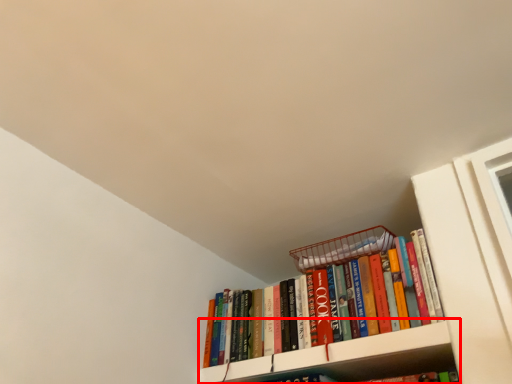
Question: From the image's perspective, what is the correct spatial relationship of cabinet (annotated by the red box) in relation to book?

Choices:
 (A) above
 (B) below

Answer: (B)